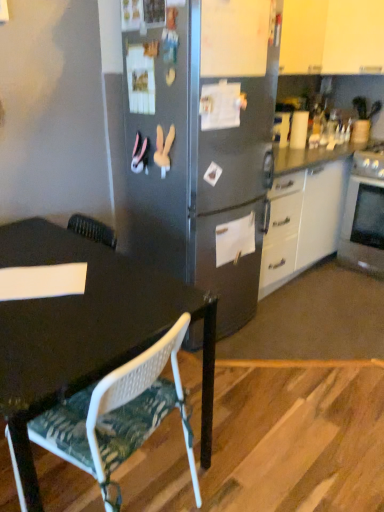
Question: Does point (342, 261) appear closer or farther from the camera than point (155, 382)?

Choices:
 (A) closer
 (B) farther

Answer: (B)

Question: Considering the positions of silver metallic oven at right and white mesh chair at lower left in the image, is silver metallic oven at right bigger or smaller than white mesh chair at lower left?

Choices:
 (A) big
 (B) small

Answer: (A)

Question: Considering the real-world distances, which object is closest to the white mesh chair at lower left?

Choices:
 (A) silver metallic oven at right
 (B) white matte cabinet at upper right

Answer: (A)

Question: Based on their relative distances, which object is farther from the white matte cabinet at upper right?

Choices:
 (A) silver metallic oven at right
 (B) white mesh chair at lower left

Answer: (B)